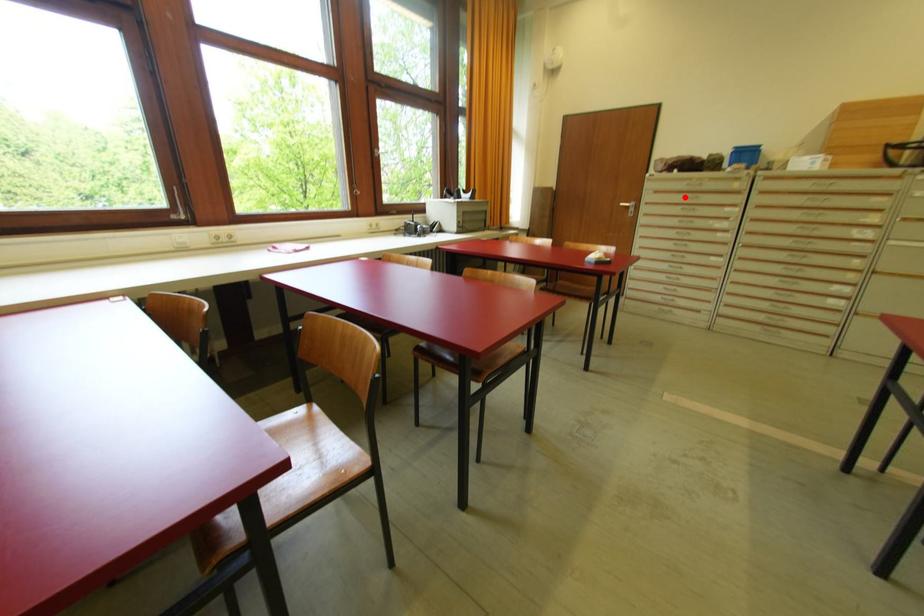
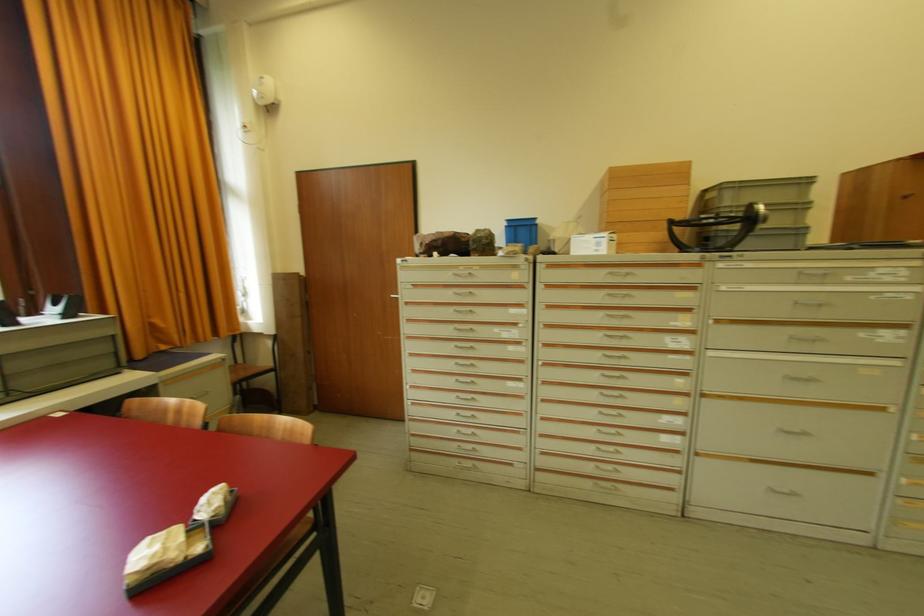
In the second image, find the point that corresponds to the highlighted location in the first image.

(454, 293)